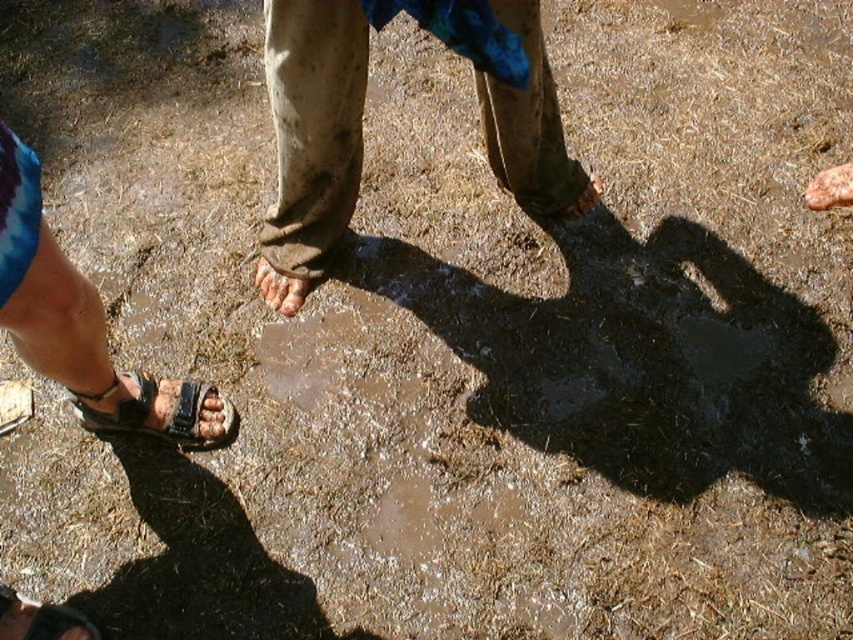
Question: From the image, what is the correct spatial relationship of brown matte toe at center in relation to brown leather toe at lower left?

Choices:
 (A) left
 (B) right

Answer: (B)

Question: Which point appears farthest from the camera in this image?

Choices:
 (A) (178, 429)
 (B) (810, 180)
 (C) (270, 275)

Answer: (B)

Question: Which of the following is the closest to the observer?

Choices:
 (A) brown leather sandals at lower left
 (B) brown matte toe at center
 (C) dirty beige pants at center

Answer: (A)

Question: Which is nearer to the brown leather toe at lower left?

Choices:
 (A) dirty beige pants at center
 (B) brown matte toe at center
 (C) brown leather sandals at lower left

Answer: (C)

Question: Can you confirm if brown sandal at center is smaller than brown leather toe at lower left?

Choices:
 (A) yes
 (B) no

Answer: (B)

Question: Is black leather sandal at lower left smaller than brown leather toe at lower left?

Choices:
 (A) no
 (B) yes

Answer: (A)